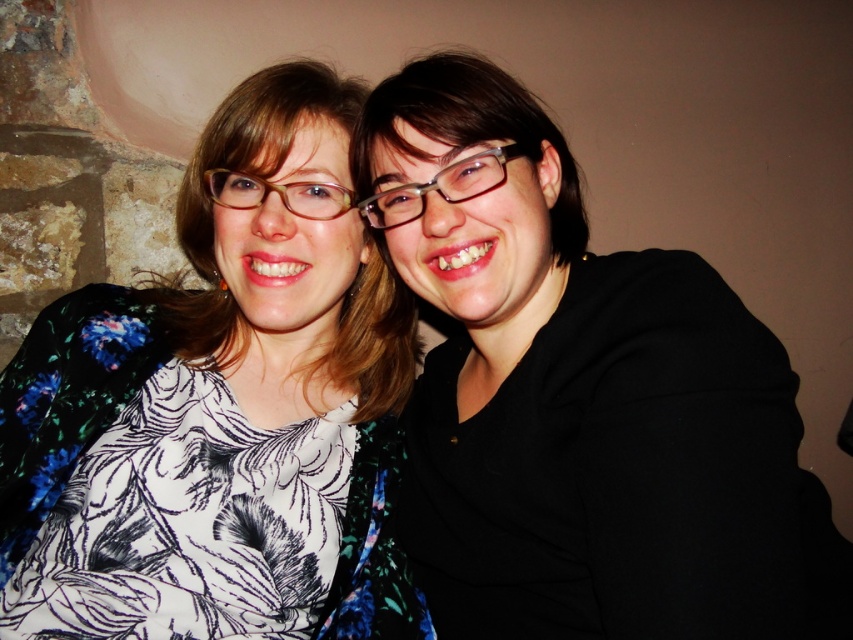
You are standing at the center of the image and want to place a small decorative item exactly at point (581,397). What object is located at that point?

The black matte jacket at right is located at point (581,397).